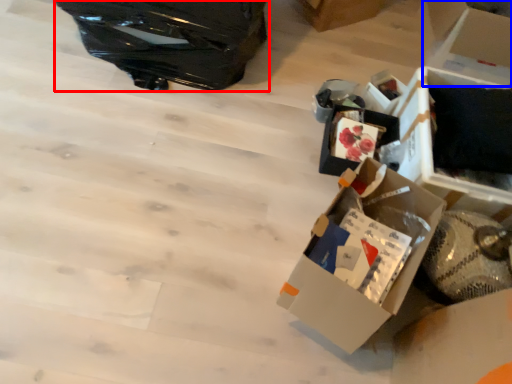
Question: Among these objects, which one is farthest to the camera, suitcase (highlighted by a red box) or cardboard box (highlighted by a blue box)?

Choices:
 (A) suitcase
 (B) cardboard box

Answer: (B)